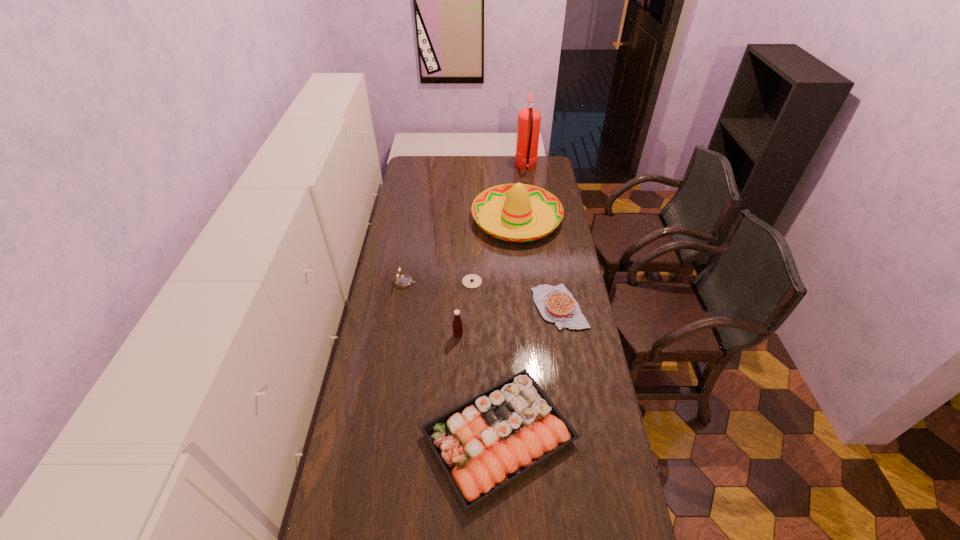
The image size is (960, 540). In order to click on object that is positioned at the far edge in this screenshot , I will do `click(528, 127)`.

This screenshot has height=540, width=960. What are the coordinates of `object situated at the left edge` in the screenshot? It's located at [x=403, y=281].

You are a GUI agent. You are given a task and a screenshot of the screen. Output one action in this format:
    pyautogui.click(x=<x>, y=<y>)
    Task: Click on the fire extinguisher that is positioned at the right edge
    
    Given the screenshot: What is the action you would take?
    pyautogui.click(x=528, y=127)

Locate an element on the screen. This screenshot has width=960, height=540. sombrero that is positioned at the right edge is located at coordinates (519, 202).

This screenshot has height=540, width=960. What are the coordinates of `platter present at the right edge` in the screenshot? It's located at (512, 426).

I want to click on pie situated at the right edge, so click(556, 304).

Locate an element on the screen. This screenshot has height=540, width=960. object that is at the far right corner is located at coordinates (528, 127).

In the image, there is a desktop. Where is `free region at the far edge`? free region at the far edge is located at coordinates (445, 158).

Find the location of `free space at the left edge`. free space at the left edge is located at coordinates (401, 259).

In the image, there is a desktop. Where is `vacant space at the right edge`? The height and width of the screenshot is (540, 960). vacant space at the right edge is located at coordinates (539, 254).